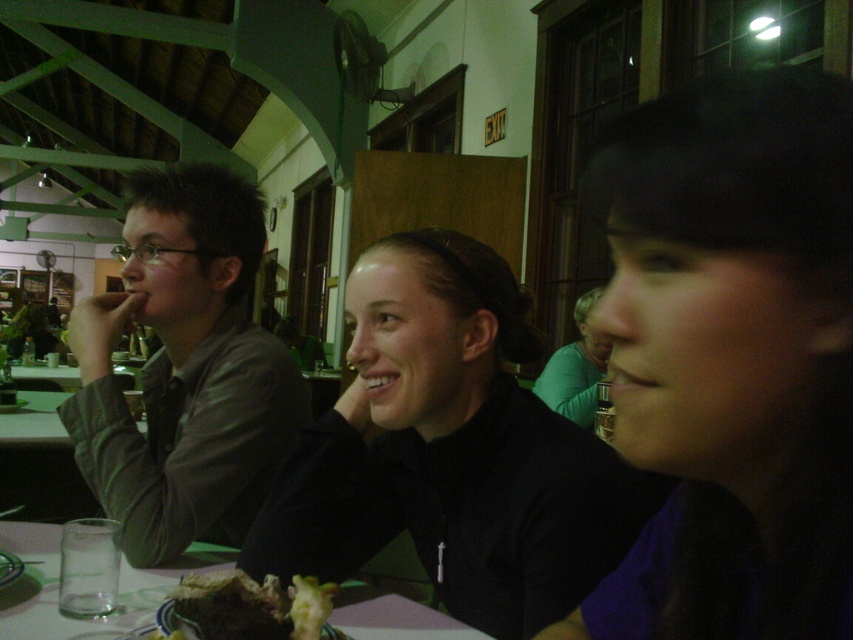
Question: Observing the image, what is the correct spatial positioning of black matte jacket at center in reference to matte brown jacket at left?

Choices:
 (A) left
 (B) right

Answer: (B)

Question: Which of these objects is positioned closest to the black matte hair at center?

Choices:
 (A) chocolate cake at center
 (B) clear glass at lower left
 (C) black matte jacket at center

Answer: (C)

Question: Which object appears farthest from the camera in this image?

Choices:
 (A) black matte jacket at center
 (B) matte brown jacket at left
 (C) clear glass at lower left

Answer: (B)

Question: From the image, what is the correct spatial relationship of clear glass at lower left in relation to chocolate cake at center?

Choices:
 (A) below
 (B) above

Answer: (A)

Question: Does clear glass at lower left appear over green matte shirt at center?

Choices:
 (A) yes
 (B) no

Answer: (B)

Question: Based on their relative distances, which object is nearer to the matte brown jacket at left?

Choices:
 (A) black matte hair at center
 (B) chocolate cake at center
 (C) black matte jacket at center

Answer: (C)